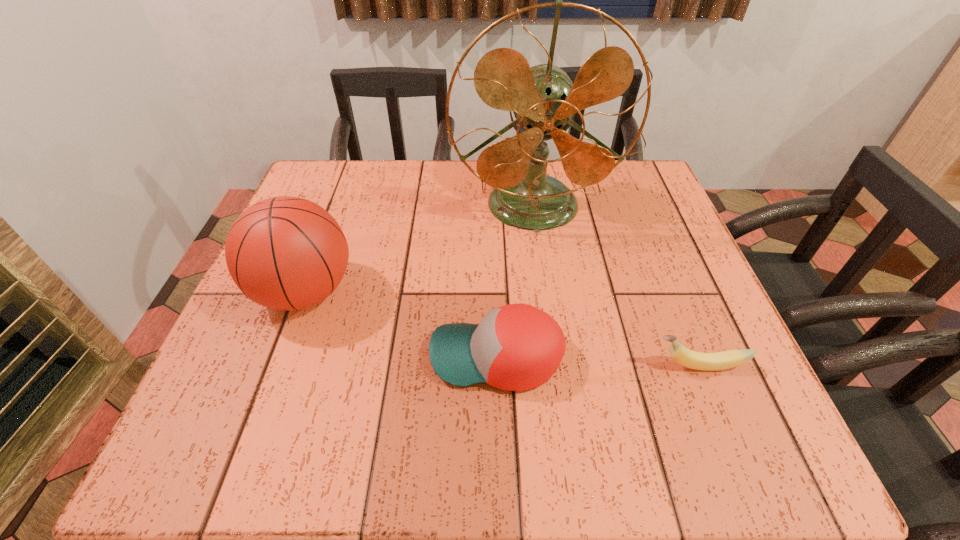
The height and width of the screenshot is (540, 960). I want to click on fan, so pos(544,100).

Locate an element on the screen. the farthest object is located at coordinates (544, 100).

I want to click on the leftmost object, so click(x=287, y=253).

The width and height of the screenshot is (960, 540). I want to click on the third shortest object, so click(287, 253).

I want to click on baseball cap, so click(x=516, y=347).

At what (x,y) coordinates should I click in order to perform the action: click on banana. Please return your answer as a coordinate pair (x, y). Looking at the image, I should click on (723, 360).

Locate an element on the screen. free region located in front of the tallest object, directing air flow is located at coordinates (554, 353).

Where is `vacant space located 0.200m on the right of the second tallest object`? This screenshot has width=960, height=540. vacant space located 0.200m on the right of the second tallest object is located at coordinates (455, 292).

Locate an element on the screen. free spot located at the brim of the baseball cap is located at coordinates (396, 357).

The height and width of the screenshot is (540, 960). I want to click on free location located at the brim of the baseball cap, so click(x=223, y=357).